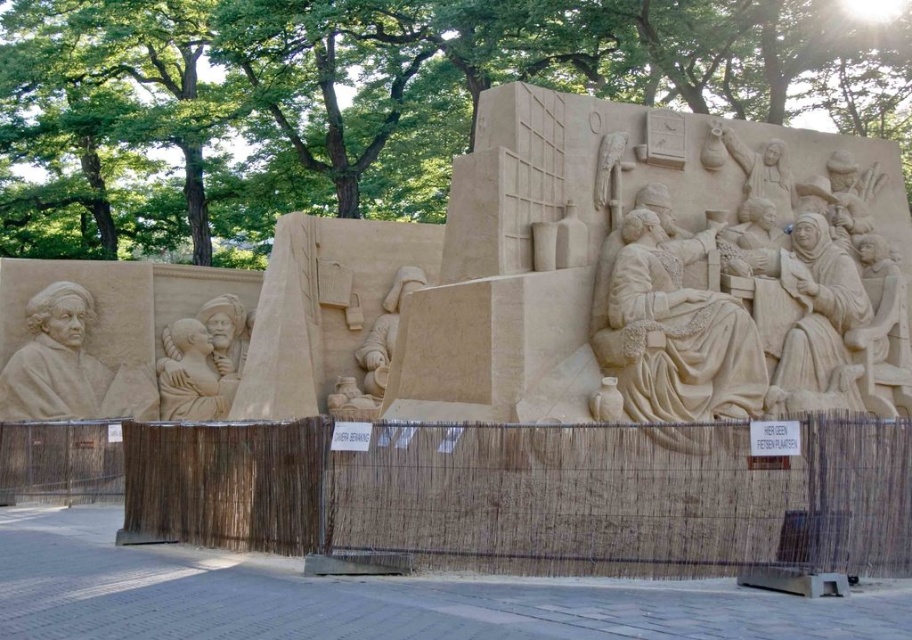
In the scene shown: You are a photographer planning to take a photo of the light beige sand sculpture at center and the smooth sand sculpture at center. Since you want to highlight both in the frame, does the height difference between them affect how you position your camera?

The light beige sand sculpture at center is taller than the smooth sand sculpture at center. To ensure both are visible in the photo, position the camera slightly lower so the taller light beige sand sculpture at center doesn not block the view of the shorter smooth sand sculpture at center.

You are a park maintenance worker who needs to place a 30 meter long safety barrier between the light beige sand sculpture at center and the smooth sand sculpture at center. Can the barrier fit between them without overlapping either sculpture?

The distance between the light beige sand sculpture at center and the smooth sand sculpture at center is 40.61 meters. Since the barrier is 30 meters long, it can fit between them without overlapping either sculpture as there is enough space.

You are a visitor at the park and want to take a photo of the light beige sand sculpture at center and the smooth sand sculpture at center. Which one is located above the other?

The light beige sand sculpture at center is positioned over the smooth sand sculpture at center, so it is located above the other.